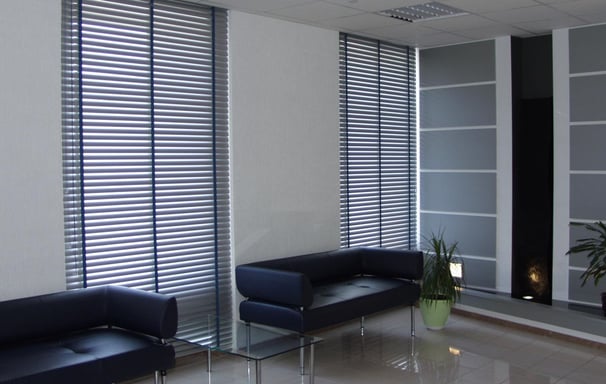
This screenshot has width=606, height=384. I want to click on blinds, so click(x=148, y=175), click(x=387, y=152).